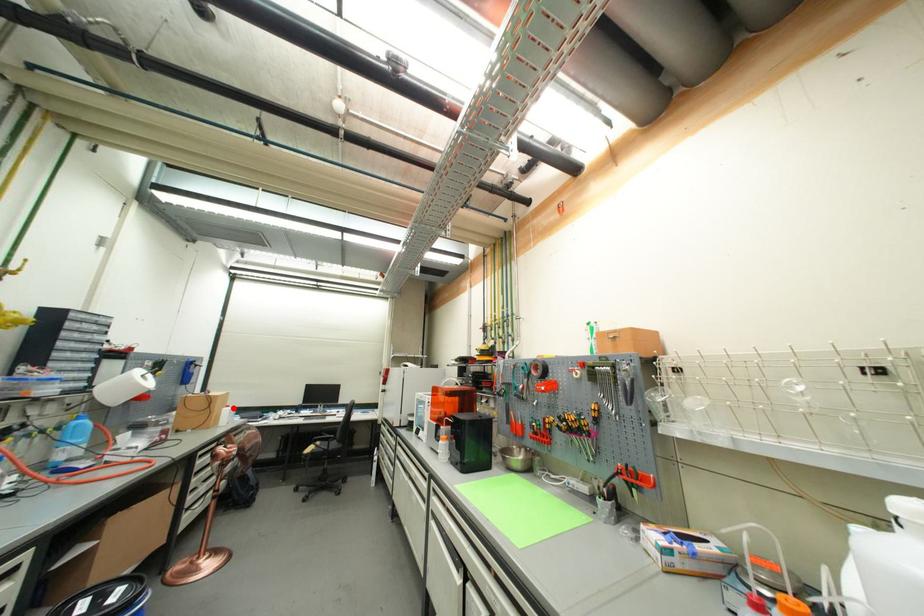
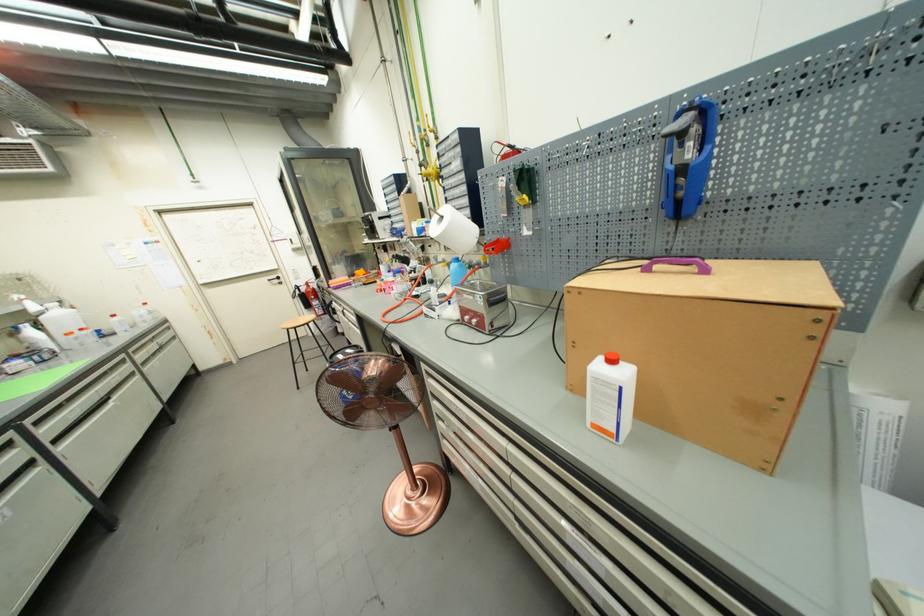
In the second image, find the point that corresponds to the highlighted location in the first image.

(617, 363)